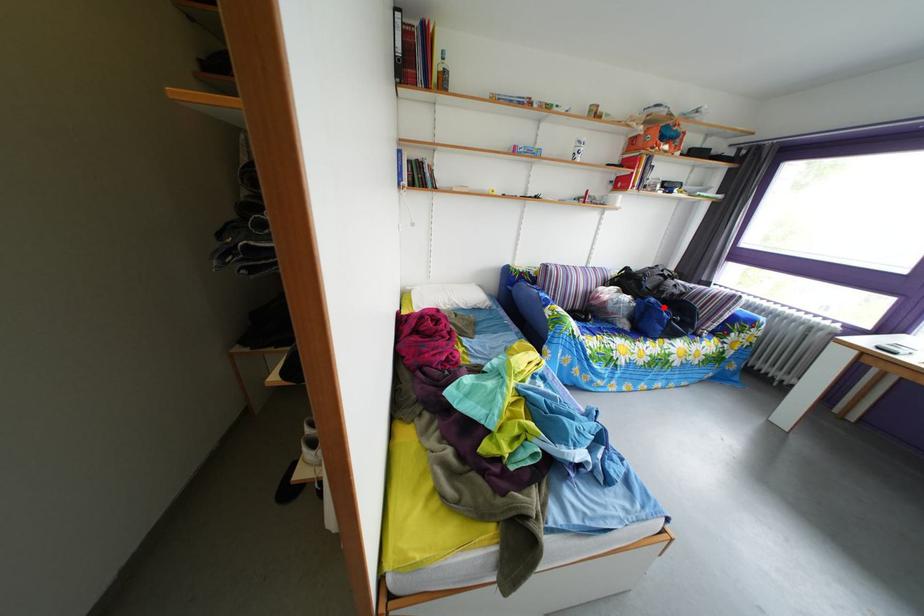
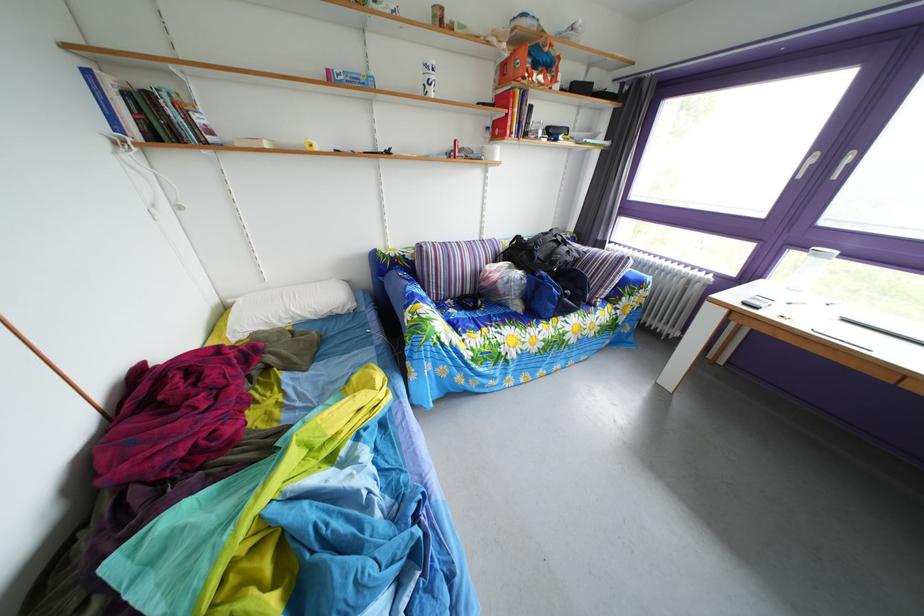
In the second image, find the point that corresponds to the highlighted location in the first image.

(553, 282)